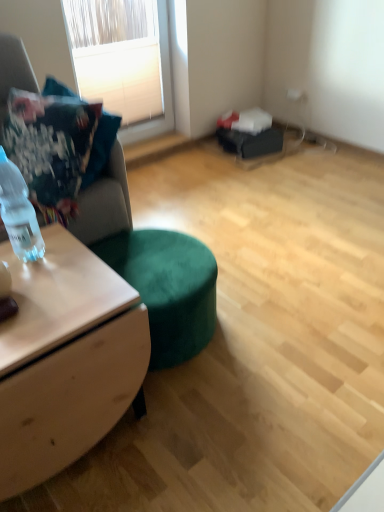
Question: In the image, is wooden desk at left positioned in front of or behind velvet cushion at left?

Choices:
 (A) behind
 (B) front

Answer: (B)

Question: Is wooden desk at left bigger or smaller than velvet cushion at left?

Choices:
 (A) big
 (B) small

Answer: (A)

Question: Considering the real-world distances, which object is farthest from the wooden desk at left?

Choices:
 (A) white textured blinds at upper left
 (B) clear plastic bottle at left
 (C) velvet cushion at left
 (D) suede fabric couch at left

Answer: (A)

Question: Which of these objects is positioned closest to the white textured blinds at upper left?

Choices:
 (A) wooden desk at left
 (B) velvet cushion at left
 (C) clear plastic bottle at left
 (D) suede fabric couch at left

Answer: (B)